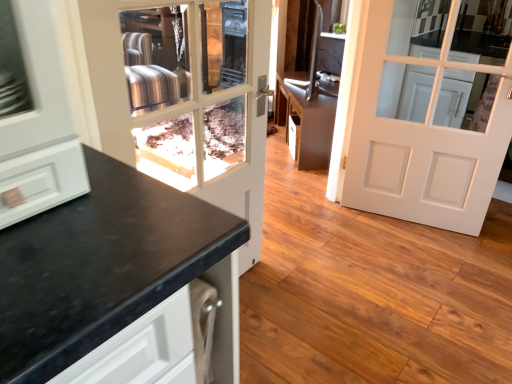
This screenshot has width=512, height=384. What are the coordinates of `free point below white matte door at center, placed as the first door when sorted from right to left (from a real-world perspective)` in the screenshot? It's located at (426, 229).